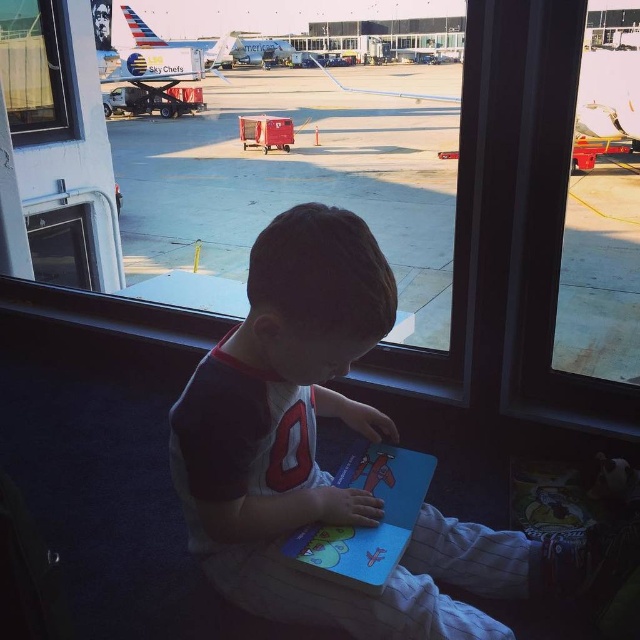
Question: Which object is positioned farthest from the white cotton shirt at center?

Choices:
 (A) white glossy airplane at upper center
 (B) transparent glass window at upper left

Answer: (A)

Question: Which point is closer to the camera?

Choices:
 (A) transparent glass window at upper left
 (B) metallic silver airplane at center
 (C) white cotton shirt at center

Answer: (C)

Question: Does metallic silver airplane at center have a smaller size compared to white glossy airplane at upper center?

Choices:
 (A) yes
 (B) no

Answer: (B)

Question: Which point is closer to the camera taking this photo?

Choices:
 (A) (312, 529)
 (B) (179, 74)
 (C) (612, 150)
 (D) (218, 461)

Answer: (D)

Question: Does matte blue book at center have a greater width compared to metallic silver airplane at center?

Choices:
 (A) yes
 (B) no

Answer: (B)

Question: Is matte blue book at center wider than metallic silver airplane at center?

Choices:
 (A) yes
 (B) no

Answer: (B)